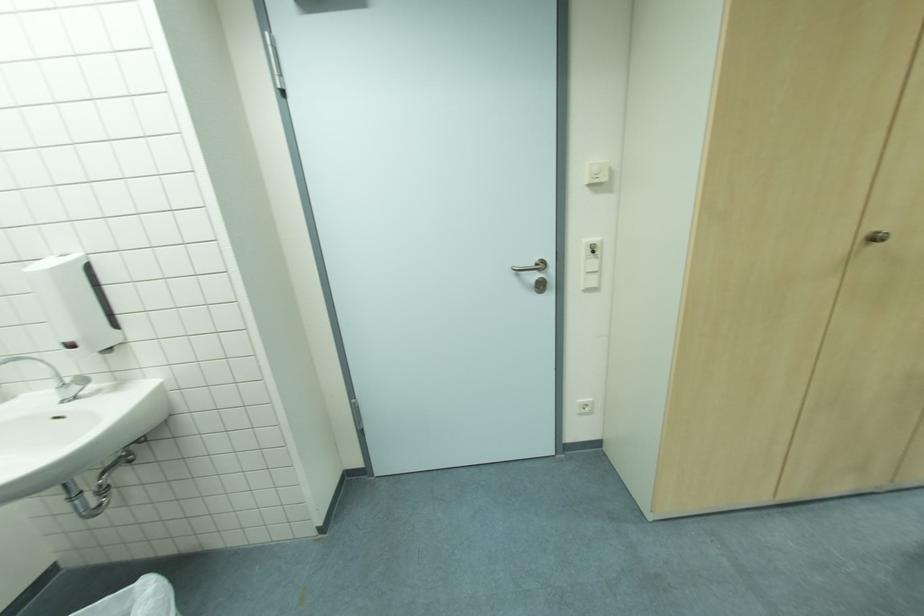
This screenshot has height=616, width=924. I want to click on cabinet door knob, so click(877, 236).